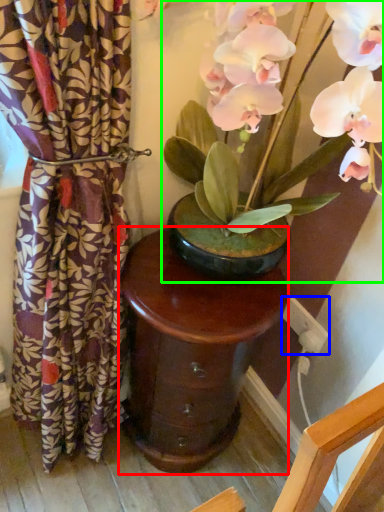
Question: Based on their relative distances, which object is farther from table (highlighted by a red box)? Choose from electric outlet (highlighted by a blue box) and houseplant (highlighted by a green box).

Choices:
 (A) electric outlet
 (B) houseplant

Answer: (A)